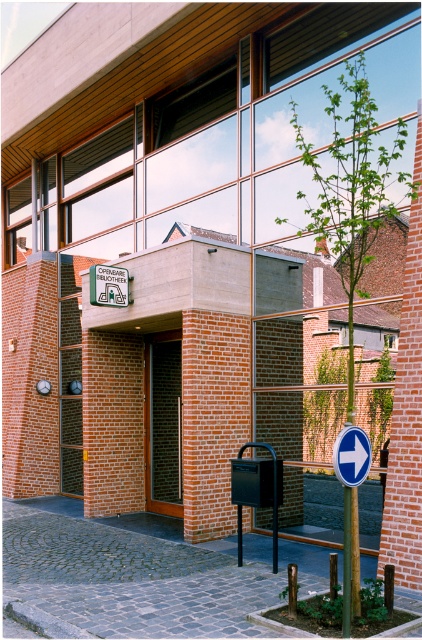
Question: Can you confirm if brown wooden door at center is positioned to the left of white plastic sign at lower right?

Choices:
 (A) no
 (B) yes

Answer: (B)

Question: Which object appears closest to the camera in this image?

Choices:
 (A) white plastic sign at lower right
 (B) brown wooden door at center

Answer: (A)

Question: Is brown wooden door at center positioned behind white plastic sign at lower right?

Choices:
 (A) no
 (B) yes

Answer: (B)

Question: Among these objects, which one is farthest from the camera?

Choices:
 (A) white plastic sign at lower right
 (B) brown wooden door at center

Answer: (B)

Question: Which point is farther to the camera?

Choices:
 (A) (151, 412)
 (B) (356, 465)

Answer: (A)

Question: Does brown wooden door at center have a larger size compared to white plastic sign at lower right?

Choices:
 (A) no
 (B) yes

Answer: (B)